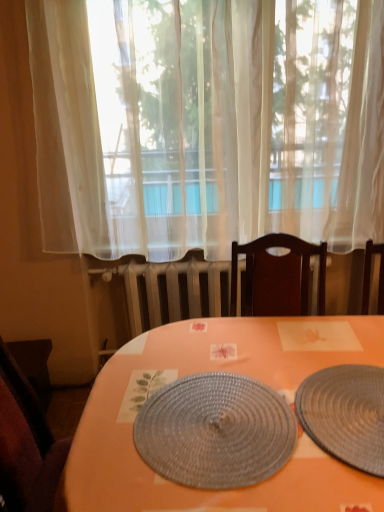
This screenshot has width=384, height=512. What do you see at coordinates (224, 371) in the screenshot? I see `orange matte placemat at center` at bounding box center [224, 371].

What do you see at coordinates (26, 443) in the screenshot? The height and width of the screenshot is (512, 384). I see `dark brown wooden chair at lower left` at bounding box center [26, 443].

Describe the element at coordinates (206, 123) in the screenshot. I see `white sheer curtain at center` at that location.

Where is `orange matte placemat at center`? The image size is (384, 512). orange matte placemat at center is located at coordinates (224, 371).

Is orange matte placemat at center looking in the opposite direction of woven gray placemat at center, which is the 2th plate in right-to-left order?

orange matte placemat at center does not have its back to woven gray placemat at center, which is the 2th plate in right-to-left order.

Considering the positions of points (320, 318) and (168, 433), is point (320, 318) farther from camera compared to point (168, 433)?

Yes, point (320, 318) is behind point (168, 433).

Which is correct: orange matte placemat at center is inside woven gray placemat at center, which is the 2th plate in right-to-left order, or outside of it?

orange matte placemat at center cannot be found inside woven gray placemat at center, which is the 2th plate in right-to-left order.

Is orange matte placemat at center in front of or behind woven gray placemat at center, which is the 2th plate in right-to-left order, in the image?

orange matte placemat at center is in front of woven gray placemat at center, which is the 2th plate in right-to-left order.

Which object is further away from the camera taking this photo, rattan placemat at center, positioned as the first plate in right-to-left order, or dark brown wooden chair at lower left?

dark brown wooden chair at lower left is further away from the camera.

In order to click on chair on the left side of rattan placemat at center, positioned as the first plate in right-to-left order in this screenshot , I will do `click(26, 443)`.

Consider the image. Can we say rattan placemat at center, positioned as the first plate in right-to-left order, lies outside dark brown wooden chair at lower left?

Yes.

Is rattan placemat at center, acting as the second plate starting from the left, beside dark brown wooden chair at lower left?

No, rattan placemat at center, acting as the second plate starting from the left, is not in contact with dark brown wooden chair at lower left.

Is dark brown wooden chair at lower left inside white sheer curtain at center?

No.

Is white sheer curtain at center further to the viewer compared to dark brown wooden chair at lower left?

No, it is in front of dark brown wooden chair at lower left.

Can you tell me how much white sheer curtain at center and dark brown wooden chair at lower left differ in facing direction?

The angle between the facing direction of white sheer curtain at center and the facing direction of dark brown wooden chair at lower left is 0.352 degrees.

Image resolution: width=384 pixels, height=512 pixels. In order to click on curtain lying on the right of dark brown wooden chair at lower left in this screenshot , I will do `click(206, 123)`.

Based on the photo, in terms of size, does dark brown wooden chair at lower left appear bigger or smaller than rattan placemat at center, positioned as the first plate in right-to-left order?

dark brown wooden chair at lower left is bigger than rattan placemat at center, positioned as the first plate in right-to-left order.

Is dark brown wooden chair at lower left completely or partially outside of rattan placemat at center, acting as the second plate starting from the left?

Yes, dark brown wooden chair at lower left is outside of rattan placemat at center, acting as the second plate starting from the left.

From a real-world perspective, count 1st plates upward from the dark brown wooden chair at lower left and point to it. Please provide its 2D coordinates.

[(346, 414)]

Does woven gray placemat at center, which is counted as the 1th plate, starting from the left, lie in front of rattan placemat at center, positioned as the first plate in right-to-left order?

No.

Between woven gray placemat at center, which is counted as the 1th plate, starting from the left, and rattan placemat at center, acting as the second plate starting from the left, which one appears on the left side from the viewer's perspective?

Positioned to the left is woven gray placemat at center, which is counted as the 1th plate, starting from the left.

Does woven gray placemat at center, which is counted as the 1th plate, starting from the left, contain rattan placemat at center, positioned as the first plate in right-to-left order?

That's incorrect, rattan placemat at center, positioned as the first plate in right-to-left order, is not inside woven gray placemat at center, which is counted as the 1th plate, starting from the left.

Which is in front, point (273, 440) or point (382, 435)?

The point (382, 435) is more forward.

Is woven gray placemat at center, which is counted as the 1th plate, starting from the left, placed right next to orange matte placemat at center?

No, woven gray placemat at center, which is counted as the 1th plate, starting from the left, is not next to orange matte placemat at center.

Is woven gray placemat at center, which is the 2th plate in right-to-left order, facing towards orange matte placemat at center?

Yes, woven gray placemat at center, which is the 2th plate in right-to-left order, faces towards orange matte placemat at center.

In the scene shown: Which object is positioned more to the left, woven gray placemat at center, which is the 2th plate in right-to-left order, or orange matte placemat at center?

From the viewer's perspective, woven gray placemat at center, which is the 2th plate in right-to-left order, appears more on the left side.

What's the angular difference between white sheer curtain at center and rattan placemat at center, positioned as the first plate in right-to-left order,'s facing directions?

0.107 degrees separate the facing orientations of white sheer curtain at center and rattan placemat at center, positioned as the first plate in right-to-left order.

From the picture: Which object is closer to the camera, white sheer curtain at center or rattan placemat at center, acting as the second plate starting from the left?

rattan placemat at center, acting as the second plate starting from the left, is closer to the camera.

Where is `plate lying on the right of white sheer curtain at center`? plate lying on the right of white sheer curtain at center is located at coordinates (346, 414).

Identify the location of plate on the left of the orange matte placemat at center. This screenshot has width=384, height=512. (215, 431).

At what (x,y) coordinates should I click in order to perform the action: click on chair below the rattan placemat at center, positioned as the first plate in right-to-left order (from a real-world perspective). Please return your answer as a coordinate pair (x, y). The height and width of the screenshot is (512, 384). Looking at the image, I should click on (26, 443).

Considering their positions, is orange matte placemat at center positioned closer to white sheer curtain at center than dark brown wooden chair at lower left?

Based on the image, orange matte placemat at center appears to be nearer to white sheer curtain at center.

Which object lies nearer to the anchor point woven gray placemat at center, which is the 2th plate in right-to-left order, rattan placemat at center, acting as the second plate starting from the left, or dark brown wooden chair at lower left?

Among the two, rattan placemat at center, acting as the second plate starting from the left, is located nearer to woven gray placemat at center, which is the 2th plate in right-to-left order.

Considering their positions, is rattan placemat at center, positioned as the first plate in right-to-left order, positioned closer to orange matte placemat at center than dark brown wooden chair at lower left?

rattan placemat at center, positioned as the first plate in right-to-left order.

When comparing their distances from dark brown wooden chair at lower left, does woven gray placemat at center, which is counted as the 1th plate, starting from the left, or white sheer curtain at center seem closer?

woven gray placemat at center, which is counted as the 1th plate, starting from the left, is closer to dark brown wooden chair at lower left.

Estimate the real-world distances between objects in this image. Which object is further from orange matte placemat at center, rattan placemat at center, positioned as the first plate in right-to-left order, or woven gray placemat at center, which is counted as the 1th plate, starting from the left?

rattan placemat at center, positioned as the first plate in right-to-left order, is further to orange matte placemat at center.

Based on their spatial positions, is white sheer curtain at center or dark brown wooden chair at lower left further from rattan placemat at center, acting as the second plate starting from the left?

Among the two, white sheer curtain at center is located further to rattan placemat at center, acting as the second plate starting from the left.

From the picture: From the image, which object appears to be nearer to dark brown wooden chair at lower left, white sheer curtain at center or orange matte placemat at center?

orange matte placemat at center is positioned closer to the anchor dark brown wooden chair at lower left.

From the image, which object appears to be nearer to white sheer curtain at center, rattan placemat at center, acting as the second plate starting from the left, or orange matte placemat at center?

The object closer to white sheer curtain at center is orange matte placemat at center.

Where is `chair between white sheer curtain at center and orange matte placemat at center vertically`? This screenshot has height=512, width=384. chair between white sheer curtain at center and orange matte placemat at center vertically is located at coordinates (26, 443).

The image size is (384, 512). Identify the location of desk between woven gray placemat at center, which is counted as the 1th plate, starting from the left, and rattan placemat at center, positioned as the first plate in right-to-left order. (224, 371).

The width and height of the screenshot is (384, 512). I want to click on plate between dark brown wooden chair at lower left and rattan placemat at center, acting as the second plate starting from the left, in the horizontal direction, so coord(215,431).

Locate an element on the screen. desk located between dark brown wooden chair at lower left and rattan placemat at center, positioned as the first plate in right-to-left order, in the left-right direction is located at coordinates (224, 371).